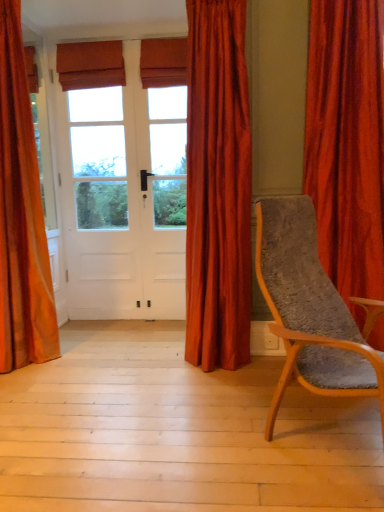
Image resolution: width=384 pixels, height=512 pixels. What are the coordinates of `free space to the left of wooden textured chair at right` in the screenshot? It's located at (189, 433).